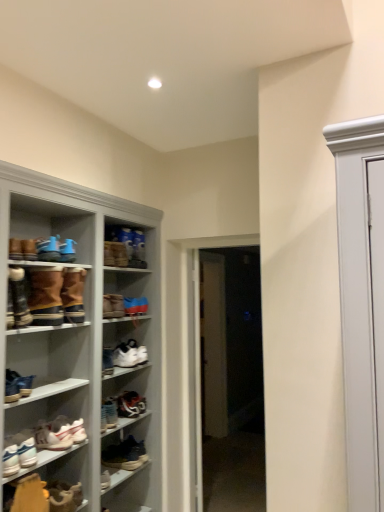
Question: Does leather sneaker at lower center, which is the 13th footwear in top-to-bottom order, appear on the right side of leather boot at lower left, arranged as the 12th footwear when viewed from the top?

Choices:
 (A) yes
 (B) no

Answer: (A)

Question: Is leather sneaker at lower center, the 1th footwear positioned from the bottom, positioned before leather boot at lower left, the 2th footwear in the bottom-to-top sequence?

Choices:
 (A) no
 (B) yes

Answer: (A)

Question: Is leather sneaker at lower center, the 1th footwear positioned from the bottom, positioned behind leather boot at lower left, arranged as the 12th footwear when viewed from the top?

Choices:
 (A) no
 (B) yes

Answer: (B)

Question: Considering the relative sizes of leather sneaker at lower center, which is the 13th footwear in top-to-bottom order, and leather boot at lower left, the 2th footwear in the bottom-to-top sequence, in the image provided, is leather sneaker at lower center, which is the 13th footwear in top-to-bottom order, thinner than leather boot at lower left, the 2th footwear in the bottom-to-top sequence,?

Choices:
 (A) yes
 (B) no

Answer: (A)

Question: From the image's perspective, does leather sneaker at lower center, which is the 13th footwear in top-to-bottom order, appear higher than leather boot at lower left, the 2th footwear in the bottom-to-top sequence?

Choices:
 (A) no
 (B) yes

Answer: (A)

Question: From their relative heights in the image, would you say blue suede sneakers at upper left, placed as the twelfth footwear when sorted from bottom to top, is taller or shorter than brown suede boot at upper center, arranged as the thirteenth footwear when ordered from the bottom?

Choices:
 (A) short
 (B) tall

Answer: (A)

Question: From a real-world perspective, is blue suede sneakers at upper left, placed as the twelfth footwear when sorted from bottom to top, above or below brown suede boot at upper center, arranged as the thirteenth footwear when ordered from the bottom?

Choices:
 (A) above
 (B) below

Answer: (B)

Question: Is point (66, 249) closer or farther from the camera than point (142, 247)?

Choices:
 (A) farther
 (B) closer

Answer: (B)

Question: From the image's perspective, is blue suede sneakers at upper left, placed as the twelfth footwear when sorted from bottom to top, located above or below brown suede boot at upper center, which is the first footwear from top to bottom?

Choices:
 (A) above
 (B) below

Answer: (B)

Question: In terms of width, does matte white sneaker at lower left, the seventh footwear positioned from the bottom, look wider or thinner when compared to brown suede boot at center, the 11th footwear when ordered from bottom to top?

Choices:
 (A) wide
 (B) thin

Answer: (B)

Question: From a real-world perspective, relative to brown suede boot at center, the 11th footwear when ordered from bottom to top, is matte white sneaker at lower left, the seventh footwear positioned from the bottom, vertically above or below?

Choices:
 (A) below
 (B) above

Answer: (A)

Question: Considering the relative positions of matte white sneaker at lower left, placed as the 7th footwear when sorted from top to bottom, and brown suede boot at center, the 11th footwear when ordered from bottom to top, in the image provided, is matte white sneaker at lower left, placed as the 7th footwear when sorted from top to bottom, to the left or to the right of brown suede boot at center, the 11th footwear when ordered from bottom to top,?

Choices:
 (A) right
 (B) left

Answer: (B)

Question: Is point (18, 389) positioned closer to the camera than point (125, 256)?

Choices:
 (A) farther
 (B) closer

Answer: (B)

Question: In the image, is brown suede boots at left, the 9th footwear from the bottom, positioned in front of or behind brown suede boot at center, the 3th footwear when ordered from top to bottom?

Choices:
 (A) behind
 (B) front

Answer: (B)

Question: Would you say brown suede boots at left, the 9th footwear from the bottom, is to the left or to the right of brown suede boot at center, the 3th footwear when ordered from top to bottom, in the picture?

Choices:
 (A) left
 (B) right

Answer: (A)